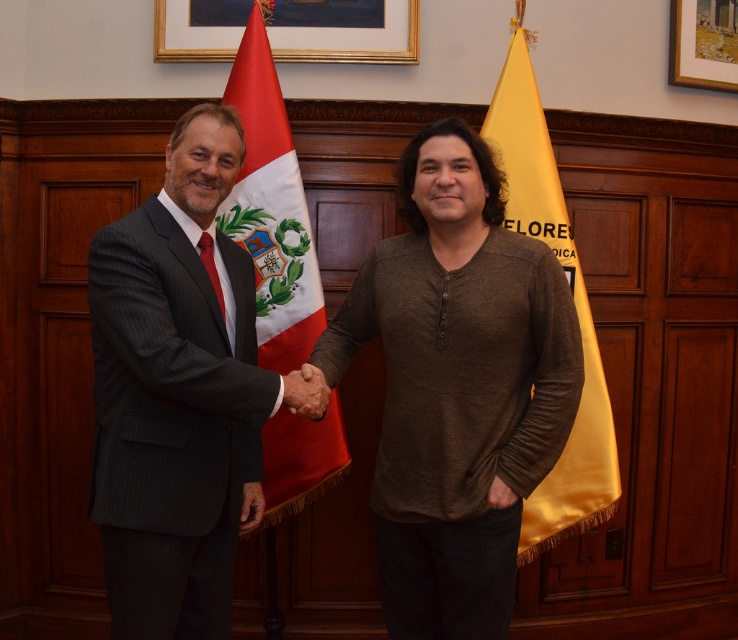
Is red/white fabric flag at center wider than wooden picture frame at upper right?

Indeed, red/white fabric flag at center has a greater width compared to wooden picture frame at upper right.

Is red/white fabric flag at center further to the viewer compared to wooden picture frame at upper right?

That is False.

Is point (317, 464) in front of point (680, 67)?

Yes, point (317, 464) is closer to viewer.

Image resolution: width=738 pixels, height=640 pixels. Find the location of `red/white fabric flag at center`. red/white fabric flag at center is located at coordinates coord(272,211).

Does brown cotton shirt at center lie in front of wooden picture frame at upper right?

Yes, brown cotton shirt at center is in front of wooden picture frame at upper right.

Does point (365, 317) come farther from viewer compared to point (711, 10)?

No.

Identify the location of brown cotton shirt at center. The width and height of the screenshot is (738, 640). (458, 387).

This screenshot has width=738, height=640. Find the location of `brown cotton shirt at center`. brown cotton shirt at center is located at coordinates (458, 387).

Between yellow satin flag at right and wooden picture frame at upper right, which one is positioned lower?

yellow satin flag at right is below.

Is the position of yellow satin flag at right less distant than that of wooden picture frame at upper right?

Yes.

Which is in front, point (537, 188) or point (703, 49)?

Point (537, 188) is in front.

This screenshot has width=738, height=640. I want to click on yellow satin flag at right, so pos(573,305).